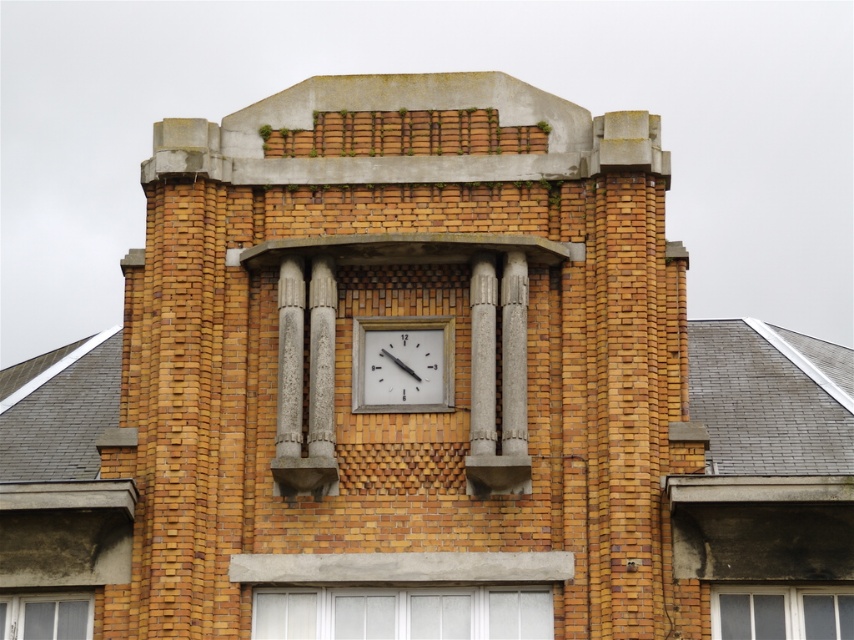
You are standing at a viewpoint where you can see the white matte clock at center. If you want to take a photo of it using a camera that has a maximum focus range of 50 meters, will you be able to focus on the clock from your current position?

The white matte clock at center and camera are 53.73 meters apart, which exceeds the camera maximum focus range of 50 meters. Therefore, you cannot focus on the clock from your current position.

You are an architect designing a new building and want to ensure that the white glass window at lower center and the clear glass window at lower left are appropriately sized for natural light. Based on the scene, which window is wider?

The white glass window at lower center is wider than the clear glass window at lower left according to the description.